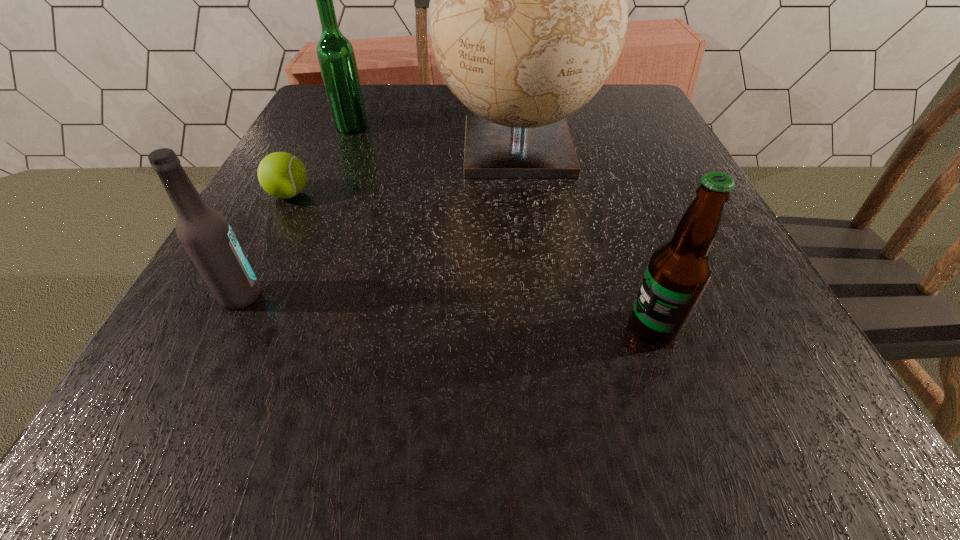
Locate which beer bottle is the second closest to the globe. Please provide its 2D coordinates. Your answer should be formatted as a tuple, i.e. [(x, y)], where the tuple contains the x and y coordinates of a point satisfying the conditions above.

[(679, 271)]

Where is `beer bottle that is the closest to the tallest object`? beer bottle that is the closest to the tallest object is located at coordinates (336, 57).